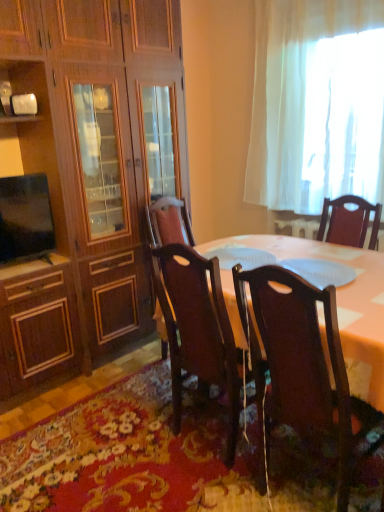
Question: Can you confirm if floral carpet at lower center is thinner than polished dark wood chair at center, the 2th chair in the right-to-left sequence?

Choices:
 (A) yes
 (B) no

Answer: (B)

Question: Can you confirm if floral carpet at lower center is smaller than polished dark wood chair at center, the 2th chair in the right-to-left sequence?

Choices:
 (A) no
 (B) yes

Answer: (B)

Question: Could you tell me if floral carpet at lower center is facing polished dark wood chair at center, the 2th chair in the right-to-left sequence?

Choices:
 (A) no
 (B) yes

Answer: (A)

Question: Can you confirm if floral carpet at lower center is wider than polished dark wood chair at center, the 1th chair viewed from the left?

Choices:
 (A) no
 (B) yes

Answer: (B)

Question: Does floral carpet at lower center touch polished dark wood chair at center, the 2th chair in the right-to-left sequence?

Choices:
 (A) yes
 (B) no

Answer: (B)

Question: Is polished dark wood chair at center, the 2th chair in the right-to-left sequence, wider or thinner than white sheer curtain at upper right?

Choices:
 (A) thin
 (B) wide

Answer: (B)

Question: From a real-world perspective, is polished dark wood chair at center, the 1th chair viewed from the left, positioned above or below white sheer curtain at upper right?

Choices:
 (A) below
 (B) above

Answer: (A)

Question: From the image's perspective, relative to white sheer curtain at upper right, is polished dark wood chair at center, the 2th chair in the right-to-left sequence, above or below?

Choices:
 (A) below
 (B) above

Answer: (A)

Question: Considering the positions of point (172, 386) and point (283, 195), is point (172, 386) closer or farther from the camera than point (283, 195)?

Choices:
 (A) closer
 (B) farther

Answer: (A)

Question: Is point (14, 279) closer or farther from the camera than point (349, 454)?

Choices:
 (A) farther
 (B) closer

Answer: (A)

Question: Visually, is wooden cabinet at left positioned to the left or to the right of dark wood chair at lower right, the second chair positioned from the left?

Choices:
 (A) right
 (B) left

Answer: (B)

Question: From the image's perspective, is wooden cabinet at left located above or below dark wood chair at lower right, arranged as the 1th chair when viewed from the right?

Choices:
 (A) below
 (B) above

Answer: (B)

Question: Looking at their shapes, would you say wooden cabinet at left is wider or thinner than dark wood chair at lower right, the second chair positioned from the left?

Choices:
 (A) wide
 (B) thin

Answer: (B)

Question: Is wooden cabinet at left bigger or smaller than matte black tv at left?

Choices:
 (A) small
 (B) big

Answer: (B)

Question: Which is correct: wooden cabinet at left is inside matte black tv at left, or outside of it?

Choices:
 (A) outside
 (B) inside

Answer: (A)